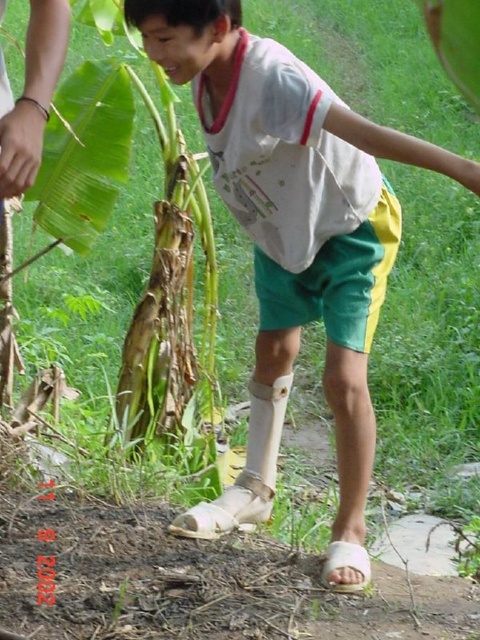
This screenshot has width=480, height=640. In order to click on white matte cast at lower center in this screenshot , I will do [x=294, y=243].

Image resolution: width=480 pixels, height=640 pixels. Describe the element at coordinates (294, 243) in the screenshot. I see `white matte cast at lower center` at that location.

Locate an element on the screen. white matte cast at lower center is located at coordinates (294, 243).